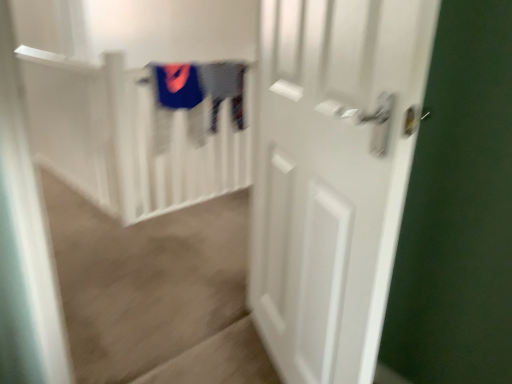
Question: In which direction should I rotate to look at velvet blue sweater at upper center, which is counted as the first clothing, starting from the left?

Choices:
 (A) left
 (B) right

Answer: (A)

Question: Is gray cotton sweater at upper center, the second clothing from the left, looking in the opposite direction of white matte stair railing at upper center?

Choices:
 (A) no
 (B) yes

Answer: (B)

Question: Is gray cotton sweater at upper center, the second clothing from the left, next to white matte stair railing at upper center?

Choices:
 (A) yes
 (B) no

Answer: (B)

Question: From the image's perspective, does gray cotton sweater at upper center, the second clothing from the left, appear lower than white matte stair railing at upper center?

Choices:
 (A) yes
 (B) no

Answer: (B)

Question: Is gray cotton sweater at upper center, the second clothing from the left, to the right of white matte stair railing at upper center from the viewer's perspective?

Choices:
 (A) yes
 (B) no

Answer: (A)

Question: Is gray cotton sweater at upper center, which is the first clothing from right to left, not near white matte stair railing at upper center?

Choices:
 (A) no
 (B) yes

Answer: (B)

Question: Can you confirm if gray cotton sweater at upper center, which is the first clothing from right to left, is smaller than white matte stair railing at upper center?

Choices:
 (A) yes
 (B) no

Answer: (A)

Question: Can you confirm if velvet blue sweater at upper center, positioned as the 2th clothing in right-to-left order, is bigger than white matte stair railing at upper center?

Choices:
 (A) no
 (B) yes

Answer: (A)

Question: Considering the relative sizes of velvet blue sweater at upper center, positioned as the 2th clothing in right-to-left order, and white matte stair railing at upper center in the image provided, is velvet blue sweater at upper center, positioned as the 2th clothing in right-to-left order, thinner than white matte stair railing at upper center?

Choices:
 (A) yes
 (B) no

Answer: (A)

Question: Could you tell me if velvet blue sweater at upper center, which is counted as the first clothing, starting from the left, is facing white matte stair railing at upper center?

Choices:
 (A) yes
 (B) no

Answer: (B)

Question: Can you confirm if velvet blue sweater at upper center, which is counted as the first clothing, starting from the left, is positioned to the right of white matte stair railing at upper center?

Choices:
 (A) yes
 (B) no

Answer: (A)

Question: Is velvet blue sweater at upper center, which is counted as the first clothing, starting from the left, at the left side of white matte stair railing at upper center?

Choices:
 (A) yes
 (B) no

Answer: (B)

Question: Is velvet blue sweater at upper center, positioned as the 2th clothing in right-to-left order, further to the viewer compared to white matte stair railing at upper center?

Choices:
 (A) no
 (B) yes

Answer: (B)

Question: Considering the relative positions of gray cotton sweater at upper center, the second clothing from the left, and white matte door at right in the image provided, is gray cotton sweater at upper center, the second clothing from the left, behind white matte door at right?

Choices:
 (A) yes
 (B) no

Answer: (A)